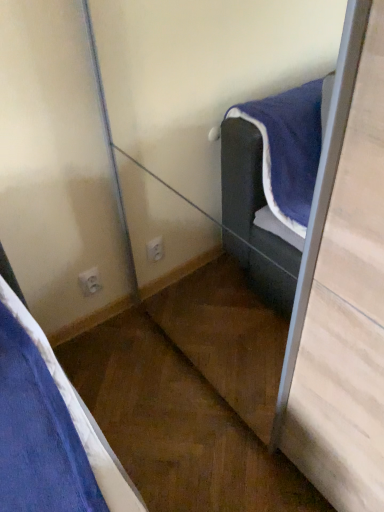
In order to face white plastic electric outlet at lower center, should I rotate leftwards or rightwards?

You should rotate left by 13.169 degrees.

Image resolution: width=384 pixels, height=512 pixels. Identify the location of white plastic electric outlet at lower center. (90, 282).

The width and height of the screenshot is (384, 512). What do you see at coordinates (90, 282) in the screenshot?
I see `white plastic electric outlet at lower center` at bounding box center [90, 282].

Image resolution: width=384 pixels, height=512 pixels. I want to click on white plastic electric outlet at lower center, so click(90, 282).